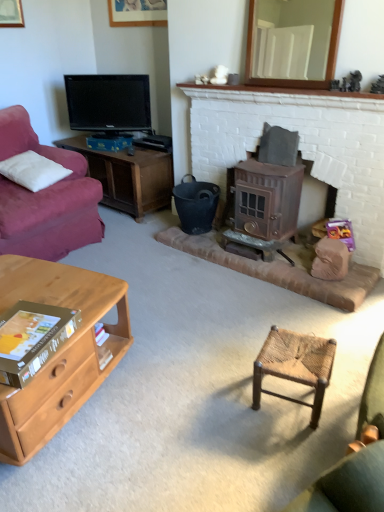
Question: From a real-world perspective, is black matte bucket at center positioned over bronze metallic wood burning stove at center-right based on gravity?

Choices:
 (A) yes
 (B) no

Answer: (B)

Question: Does black matte bucket at center have a smaller size compared to bronze metallic wood burning stove at center-right?

Choices:
 (A) yes
 (B) no

Answer: (A)

Question: Is the position of black matte bucket at center more distant than that of bronze metallic wood burning stove at center-right?

Choices:
 (A) yes
 (B) no

Answer: (A)

Question: Is black matte bucket at center in contact with bronze metallic wood burning stove at center-right?

Choices:
 (A) yes
 (B) no

Answer: (B)

Question: From a real-world perspective, does black matte bucket at center sit lower than bronze metallic wood burning stove at center-right?

Choices:
 (A) no
 (B) yes

Answer: (B)

Question: Would you say bronze metallic wood burning stove at center-right is to the left or to the right of wooden picture frame at upper center in the picture?

Choices:
 (A) right
 (B) left

Answer: (A)

Question: In the image, is bronze metallic wood burning stove at center-right positioned in front of or behind wooden picture frame at upper center?

Choices:
 (A) behind
 (B) front

Answer: (B)

Question: Considering the positions of bronze metallic wood burning stove at center-right and wooden picture frame at upper center in the image, is bronze metallic wood burning stove at center-right bigger or smaller than wooden picture frame at upper center?

Choices:
 (A) big
 (B) small

Answer: (A)

Question: Is bronze metallic wood burning stove at center-right taller or shorter than wooden picture frame at upper center?

Choices:
 (A) tall
 (B) short

Answer: (A)

Question: From a real-world perspective, relative to light brown wood desk at lower left, is woven wood stool at center vertically above or below?

Choices:
 (A) below
 (B) above

Answer: (A)

Question: In terms of width, does woven wood stool at center look wider or thinner when compared to light brown wood desk at lower left?

Choices:
 (A) wide
 (B) thin

Answer: (B)

Question: From the image's perspective, is woven wood stool at center located above or below light brown wood desk at lower left?

Choices:
 (A) below
 (B) above

Answer: (A)

Question: Considering the relative positions of woven wood stool at center and light brown wood desk at lower left in the image provided, is woven wood stool at center to the left or to the right of light brown wood desk at lower left?

Choices:
 (A) right
 (B) left

Answer: (A)

Question: Considering their positions, is light brown wood desk at lower left located in front of or behind woven wood stool at center?

Choices:
 (A) front
 (B) behind

Answer: (A)

Question: From a real-world perspective, is light brown wood desk at lower left above or below woven wood stool at center?

Choices:
 (A) below
 (B) above

Answer: (B)